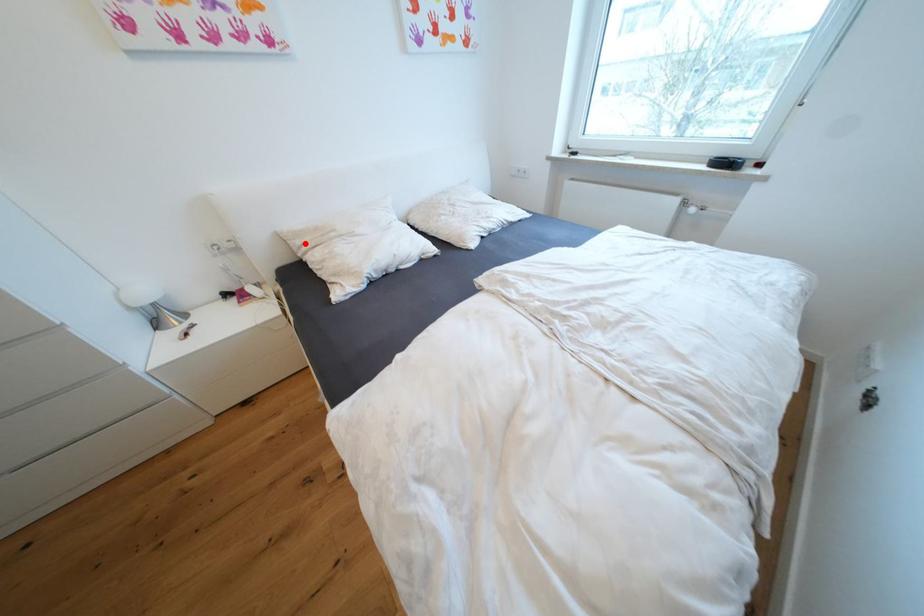
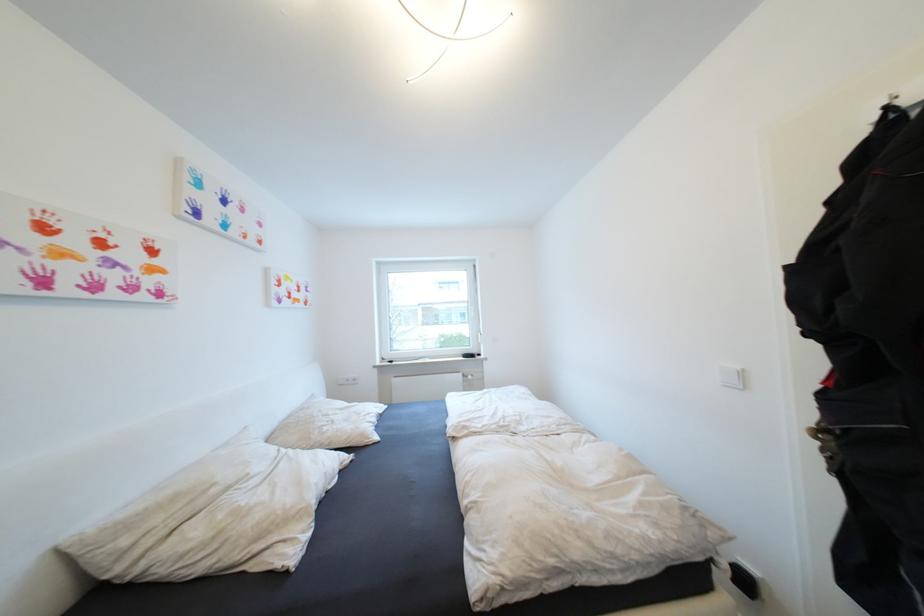
Locate, in the second image, the point that corresponds to the highlighted location in the first image.

(131, 543)